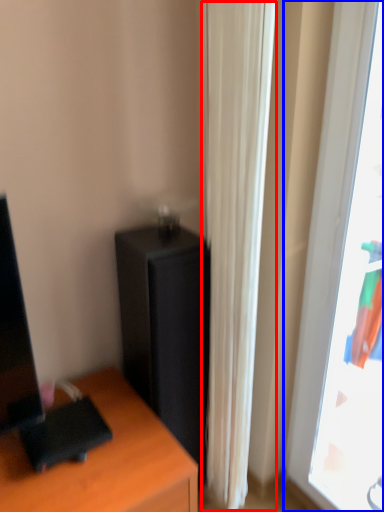
Question: Among these objects, which one is farthest to the camera, curtain (highlighted by a red box) or window (highlighted by a blue box)?

Choices:
 (A) curtain
 (B) window

Answer: (A)